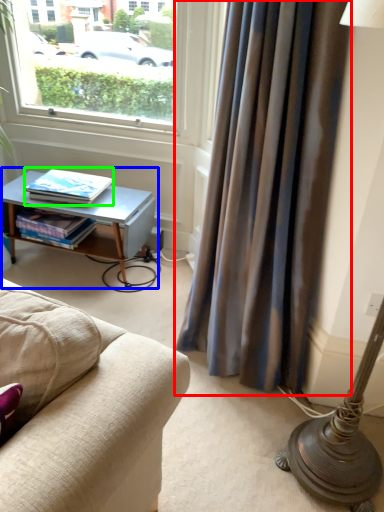
Question: Based on their relative distances, which object is nearer to curtain (highlighted by a red box)? Choose from table (highlighted by a blue box) and book (highlighted by a green box).

Choices:
 (A) table
 (B) book

Answer: (A)